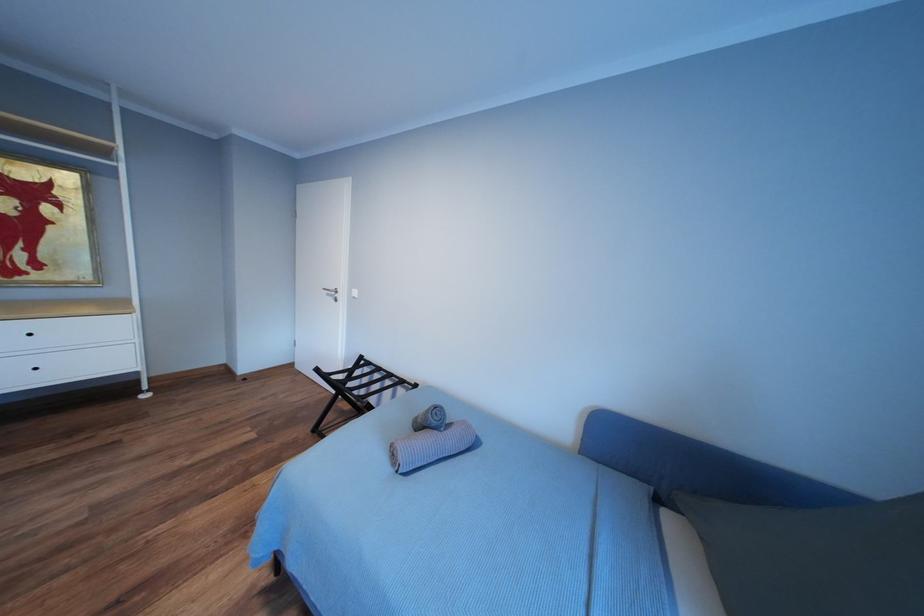
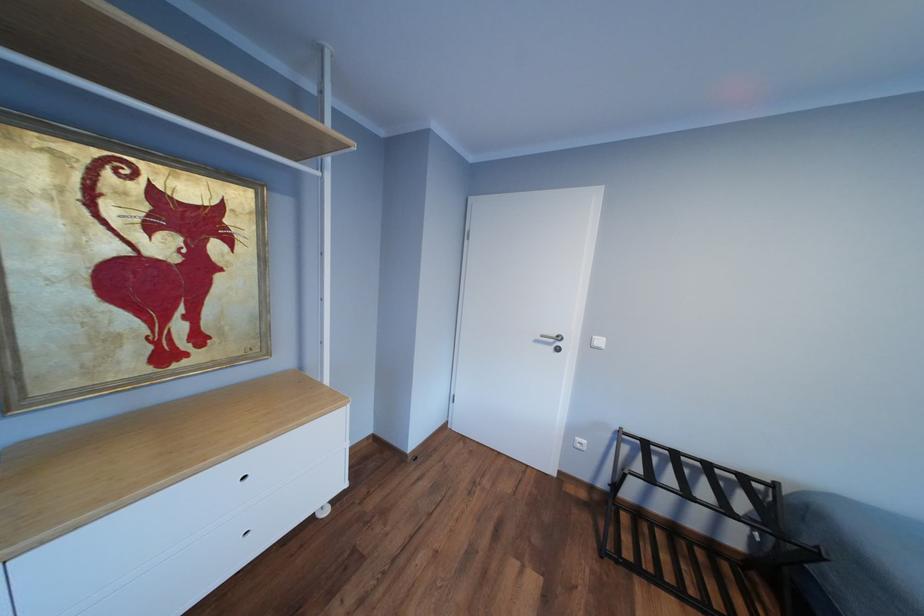
Question: In a continuous first-person perspective shot, in which direction is the camera moving?

Choices:
 (A) Left
 (B) Right
 (C) Forward
 (D) Backward

Answer: (A)